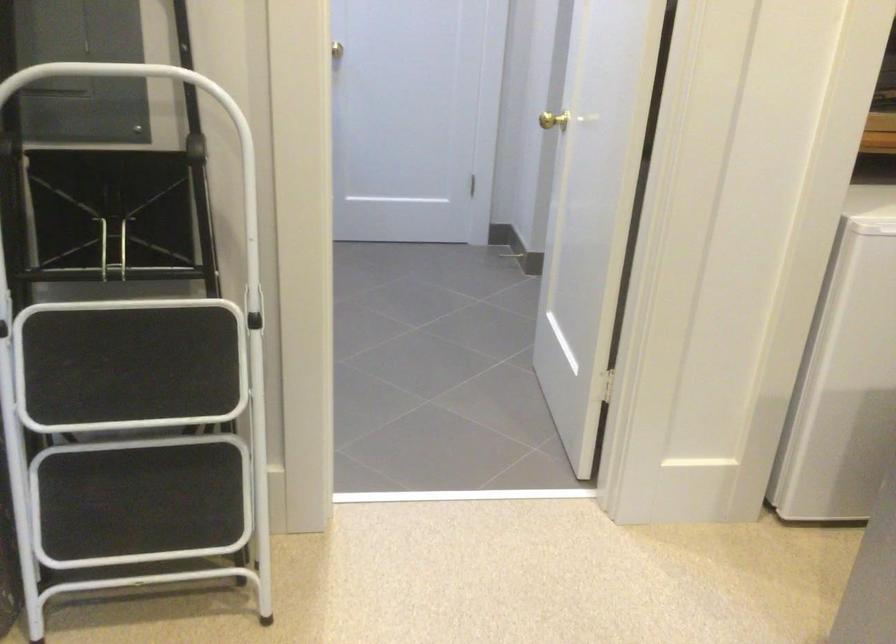
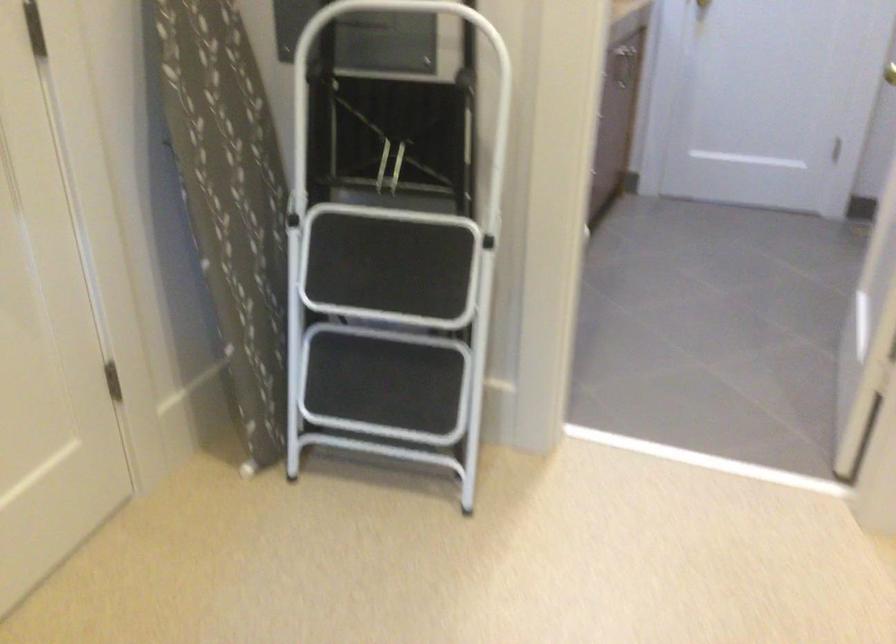
In the second image, find the point that corresponds to point 97,433 in the first image.

(371, 324)